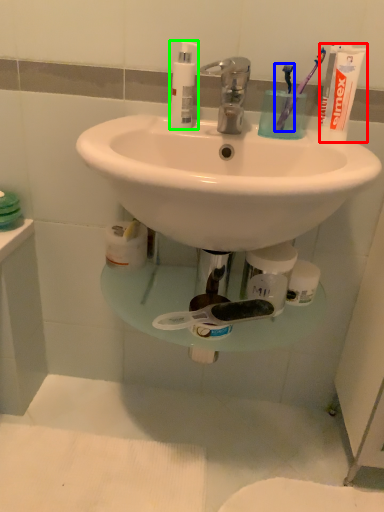
Question: Which object is positioned farthest from toothpaste (highlighted by a red box)? Select from toothbrush (highlighted by a blue box) and soap dispenser (highlighted by a green box).

Choices:
 (A) toothbrush
 (B) soap dispenser

Answer: (B)